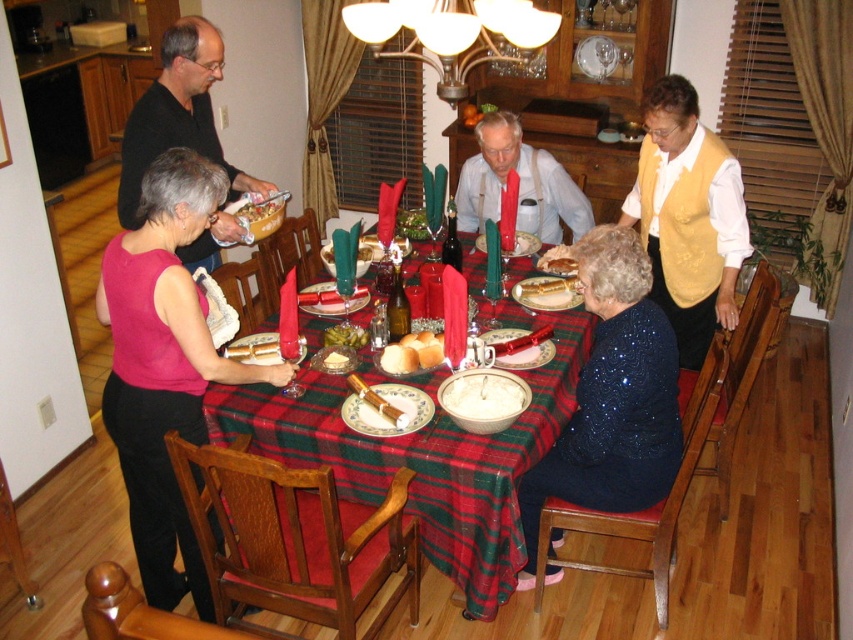
Which is in front, point (532, 483) or point (497, 403)?

Point (497, 403) is more forward.

Is point (656, 429) more distant than point (448, 400)?

No, (656, 429) is in front of (448, 400).

What are the coordinates of `sparkly blue dress at lower center` in the screenshot? It's located at (612, 396).

Does point (549, 188) lie in front of point (341, 339)?

No, (549, 188) is further to viewer.

Where is `matte white shirt at center`? matte white shirt at center is located at coordinates (518, 184).

Does sparkly blue dress at lower center come behind matte white shirt at center?

No, sparkly blue dress at lower center is closer to the viewer.

Is sparkly blue dress at lower center wider than matte white shirt at center?

No.

Describe the element at coordinates (612, 396) in the screenshot. This screenshot has width=853, height=640. I see `sparkly blue dress at lower center` at that location.

Find the location of `sparkly blue dress at lower center`. sparkly blue dress at lower center is located at coordinates (612, 396).